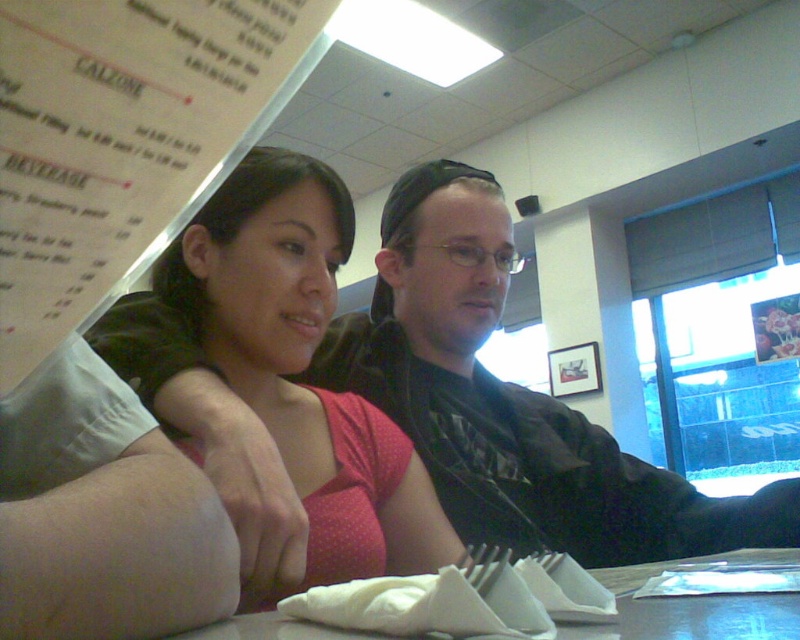
You are a delivery person standing at the entrance of the restaurant and need to pick up an order. The white paper menu at upper left has the pickup instructions. Can you read the menu from your current position?

The white paper menu at upper left is 7.49 inches from camera, so yes, you can read the menu from your current position as it is very close.

You are a server at the restaurant and need to deliver a drink to the table. The drink must be placed on the table between the white paper menu at upper left and the pink dotted fabric at center. Given that the menu is narrower than the fabric, where should you place the drink to ensure it is centered between them?

The white paper menu at upper left has a lesser width compared to the pink dotted fabric at center. To center the drink between them, place it closer to the menu since the menu takes up less space, balancing the distance from both objects.

You are a waiter at the restaurant and need to deliver a drink to the customer. The drink needs to be placed on the table without spilling. Considering the pink dotted fabric at center and the white paper napkin at lower center, which object should you place the drink on to ensure it stays stable?

The white paper napkin at lower center is behind the pink dotted fabric at center, so placing the drink on the white paper napkin at lower center would ensure stability as it is likely a flat surface on the table.